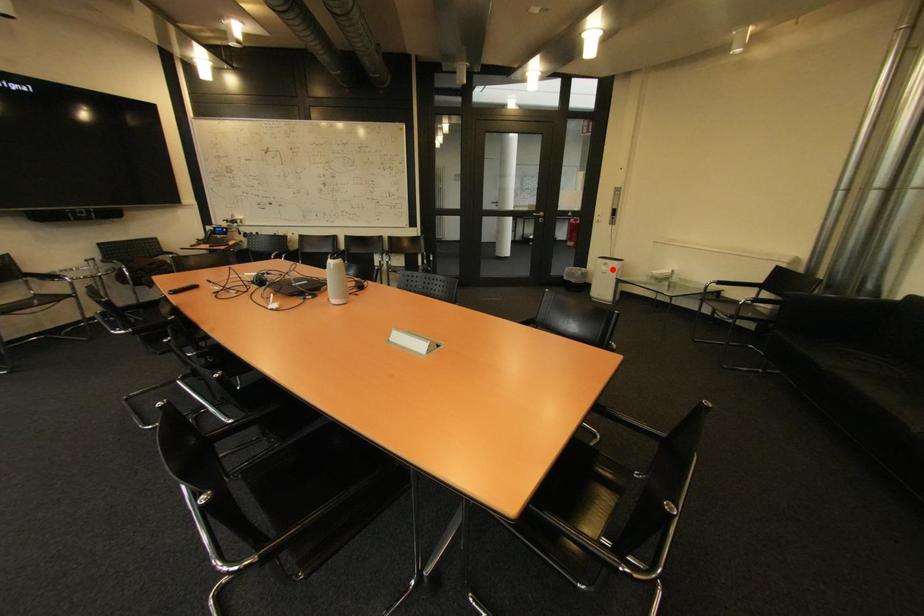
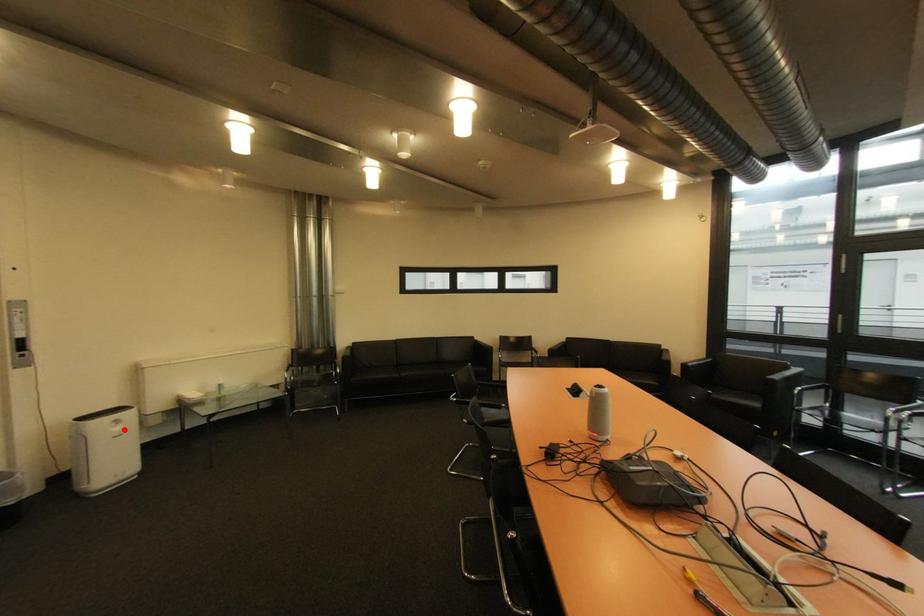
I am providing you with two images of the same scene from different viewpoints. A red point is marked on the first image and another point is marked on the second image. Is the marked point in image1 the same physical position as the marked point in image2?

Yes